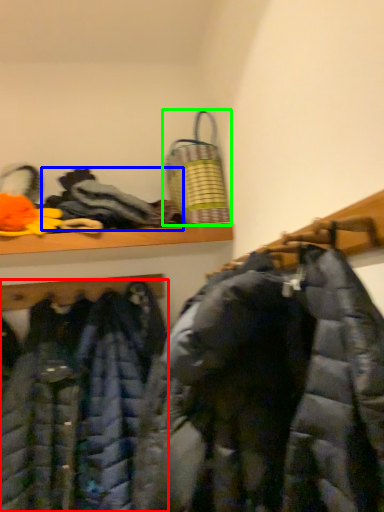
Question: Based on their relative distances, which object is farther from jacket (highlighted by a red box)? Choose from cloak (highlighted by a blue box) and laundry basket (highlighted by a green box).

Choices:
 (A) cloak
 (B) laundry basket

Answer: (B)